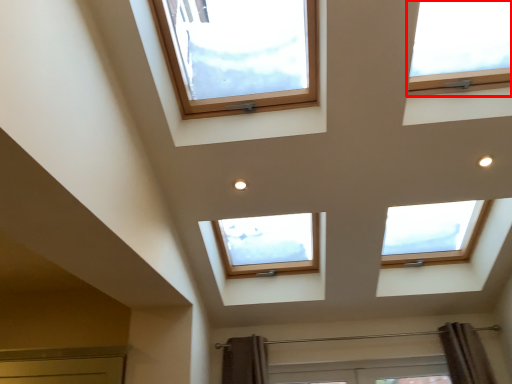
Question: From the image's perspective, considering the relative positions of window (annotated by the red box) and window in the image provided, where is window (annotated by the red box) located with respect to the staircase?

Choices:
 (A) below
 (B) above

Answer: (B)